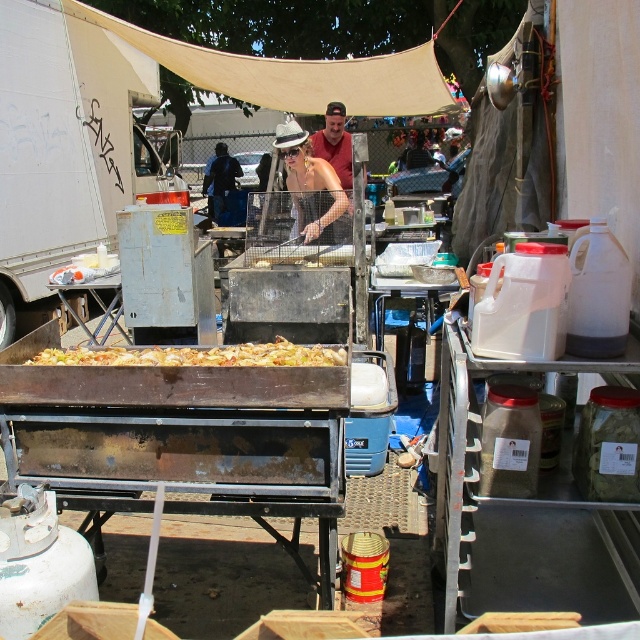
You are a customer waiting in line at the food stall. You see the golden brown crispy food at center and the matte red shirt at center. Which item is located to the left of the other?

The golden brown crispy food at center is positioned on the left side of matte red shirt at center.

You are a customer at the market and you want to grab a snack from the golden brown crispy food at center before the person in the matte red shirt at center does. Based on their heights, can you reach the food first?

The golden brown crispy food at center has a lesser height compared to matte red shirt at center, so the food is lower than the shirt. Since you are shorter than the person in the matte red shirt at center, you might not be able to reach it first unless you move closer.